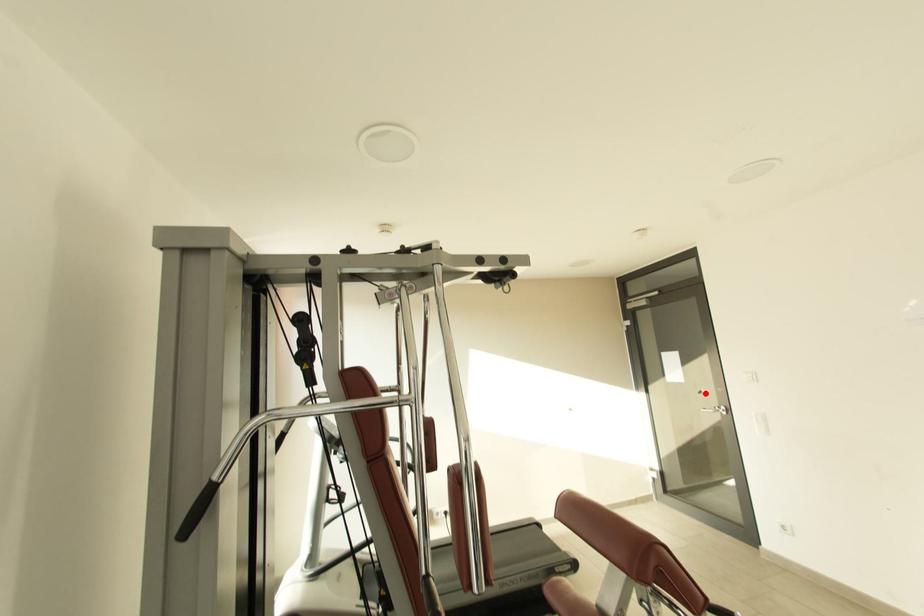
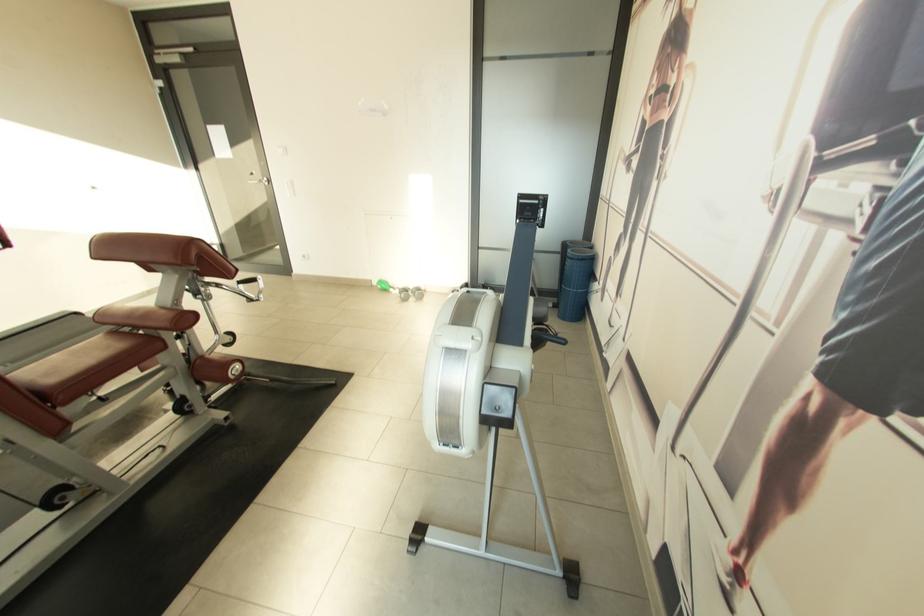
In the second image, find the point that corresponds to the highlighted location in the first image.

(258, 175)